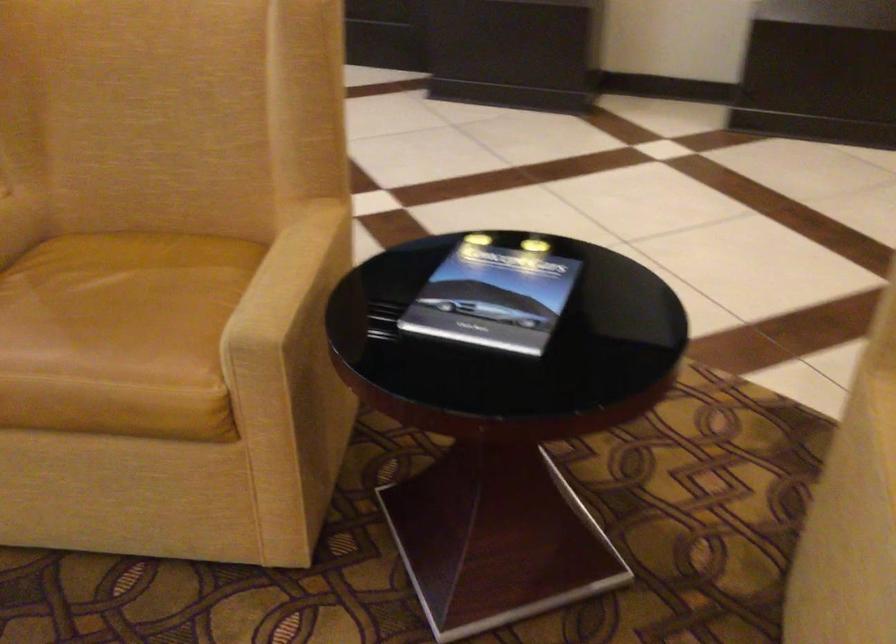
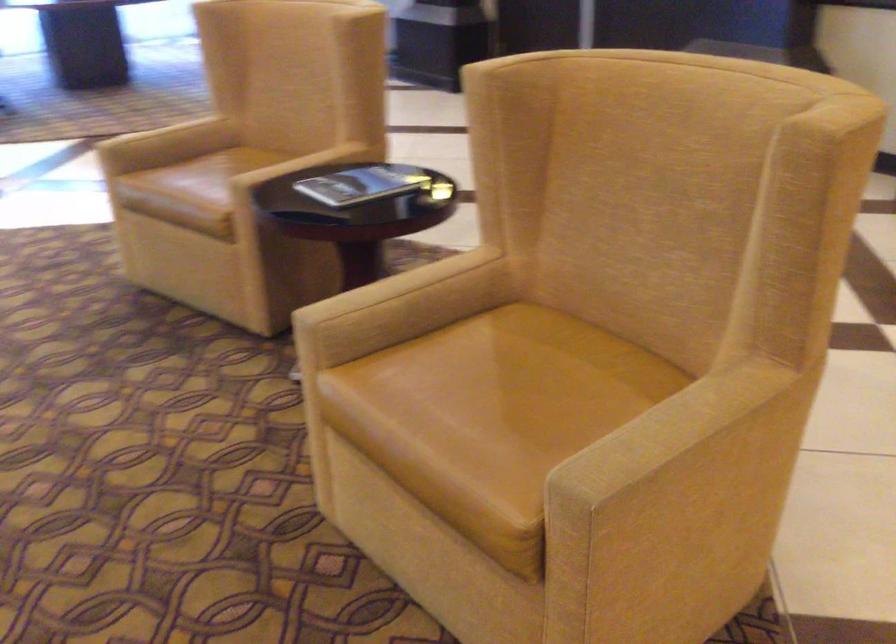
Where in the second image is the point corresponding to point (486, 292) from the first image?

(363, 184)